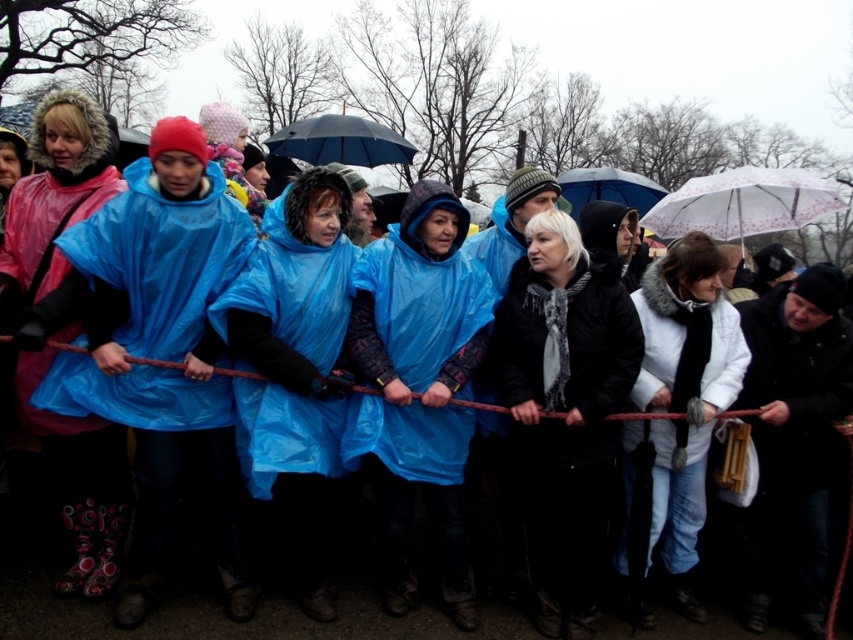
Question: Where is pink matte raincoat at left located in relation to transparent plastic umbrella at center in the image?

Choices:
 (A) above
 (B) below

Answer: (B)

Question: Which object appears farthest from the camera in this image?

Choices:
 (A) matte black umbrella at center
 (B) blue glossy poncho at center
 (C) transparent floral-patterned umbrella at upper center

Answer: (A)

Question: Which is farther from the transparent floral-patterned umbrella at upper center?

Choices:
 (A) white fur-trimmed coat at center
 (B) matte black umbrella at center

Answer: (B)

Question: Does pink matte raincoat at left appear on the right side of transparent plastic umbrella at center?

Choices:
 (A) no
 (B) yes

Answer: (A)

Question: Can you confirm if blue glossy poncho at center is wider than matte black umbrella at center?

Choices:
 (A) yes
 (B) no

Answer: (B)

Question: Among these objects, which one is farthest from the camera?

Choices:
 (A) matte black umbrella at center
 (B) white fur-trimmed coat at center

Answer: (A)